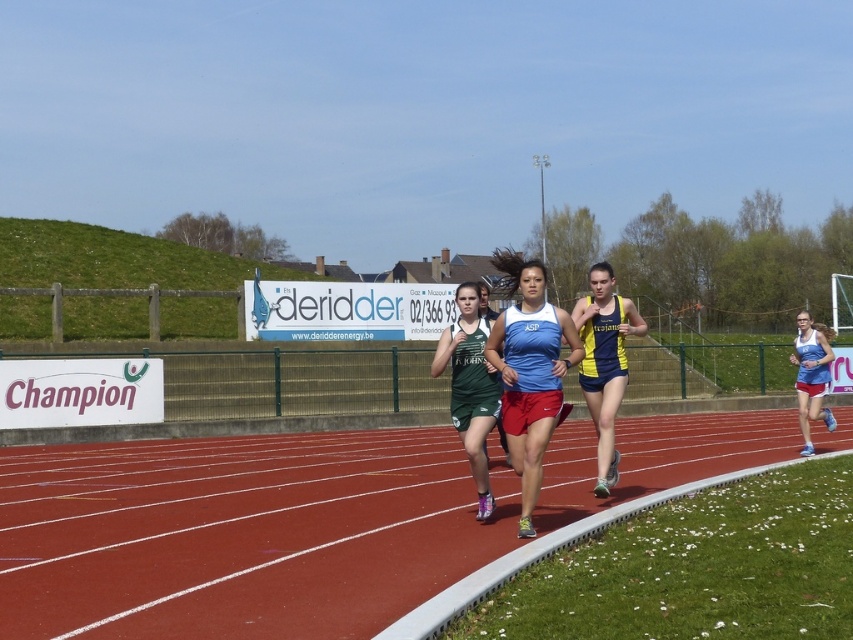
Question: Is red rubber track at center further to camera compared to yellow/blue athletic uniform at center?

Choices:
 (A) no
 (B) yes

Answer: (A)

Question: Which is nearer to the blue jersey at center?

Choices:
 (A) red rubber track at center
 (B) blue fabric tank top at center

Answer: (A)

Question: Can you confirm if yellow/blue athletic uniform at center is positioned to the left of green athletic uniform at center?

Choices:
 (A) no
 (B) yes

Answer: (A)

Question: Does red rubber track at center have a smaller size compared to blue jersey at center?

Choices:
 (A) yes
 (B) no

Answer: (B)

Question: Which object is positioned closest to the green athletic uniform at center?

Choices:
 (A) yellow/blue athletic uniform at center
 (B) blue fabric tank top at center
 (C) red rubber track at center

Answer: (B)

Question: Considering the real-world distances, which object is closest to the blue fabric tank top at center?

Choices:
 (A) red rubber track at center
 (B) blue jersey at center
 (C) yellow/blue athletic uniform at center

Answer: (C)